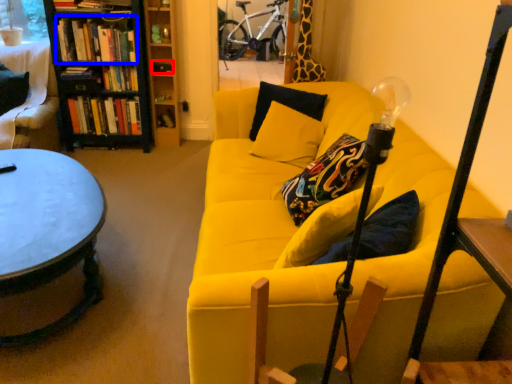
Question: Which object is closer to the camera taking this photo, book (highlighted by a red box) or book (highlighted by a blue box)?

Choices:
 (A) book
 (B) book

Answer: (B)